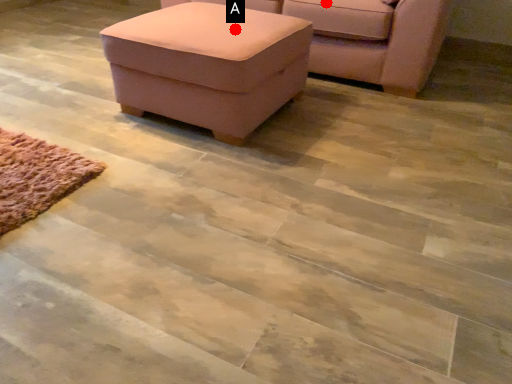
Question: Two points are circled on the image, labeled by A and B beside each circle. Which of the following is the closest to the observer?

Choices:
 (A) A is closer
 (B) B is closer

Answer: (A)